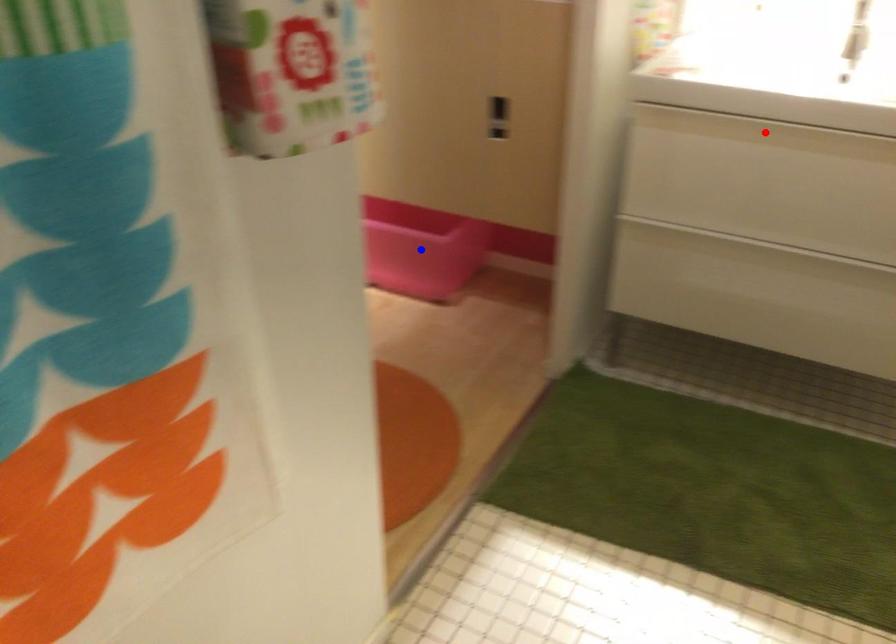
Question: Which of the two points in the image is closer to the camera?

Choices:
 (A) Blue point is closer.
 (B) Red point is closer.

Answer: (B)